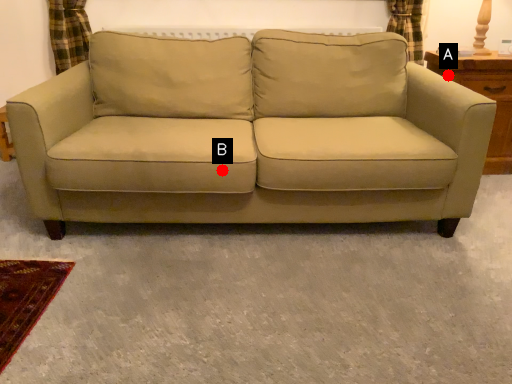
Question: Two points are circled on the image, labeled by A and B beside each circle. Which of the following is the farthest from the observer?

Choices:
 (A) A is further
 (B) B is further

Answer: (A)